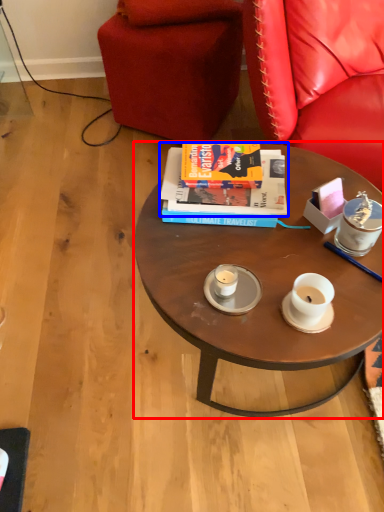
Question: Which object appears farthest to the camera in this image, coffee table (highlighted by a red box) or book (highlighted by a blue box)?

Choices:
 (A) coffee table
 (B) book

Answer: (B)